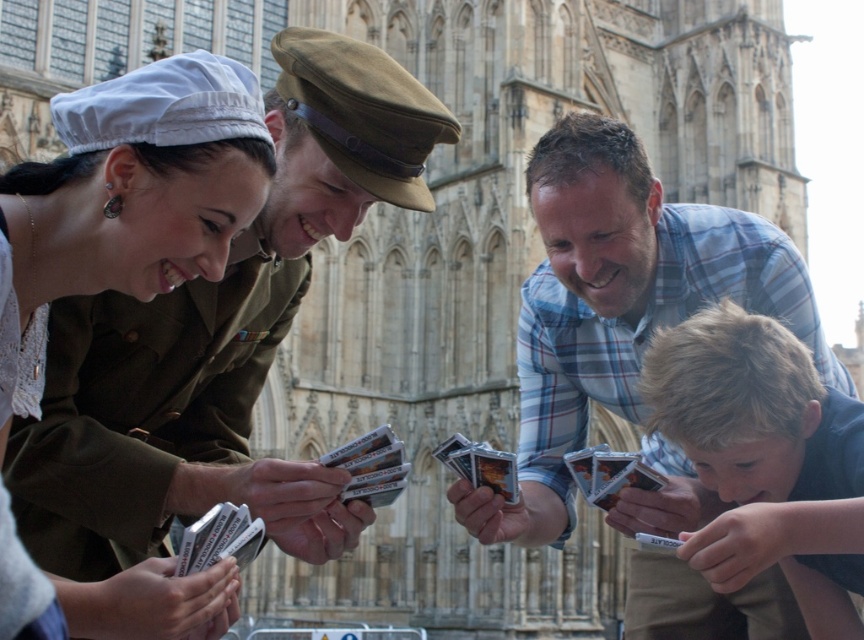
Does blue plaid shirt at center appear over blonde hair boy at lower right?

No.

Does point (543, 337) come in front of point (764, 484)?

No, (543, 337) is behind (764, 484).

Locate an element on the screen. blue plaid shirt at center is located at coordinates (618, 307).

Does matte khaki uniform at center appear over blonde hair boy at lower right?

Yes.

Does point (98, 182) come closer to viewer compared to point (843, 465)?

Yes.

Who is more distant from viewer, (144, 269) or (747, 314)?

The point (747, 314) is more distant.

Locate an element on the screen. matte khaki uniform at center is located at coordinates (131, 195).

Does blue plaid shirt at center have a lesser height compared to matte khaki uniform at center?

No.

Who is shorter, blue plaid shirt at center or matte khaki uniform at center?

Standing shorter between the two is matte khaki uniform at center.

Does point (545, 172) come behind point (145, 108)?

Yes, point (545, 172) is behind point (145, 108).

At what (x,y) coordinates should I click in order to perform the action: click on blue plaid shirt at center. Please return your answer as a coordinate pair (x, y). Looking at the image, I should click on (618, 307).